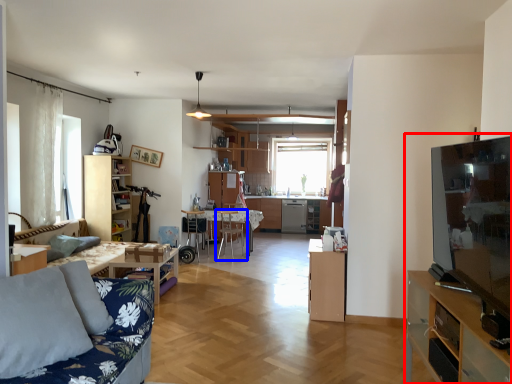
Question: Which point is closer to the camera, entertainment center (highlighted by a red box) or chair (highlighted by a blue box)?

Choices:
 (A) entertainment center
 (B) chair

Answer: (A)